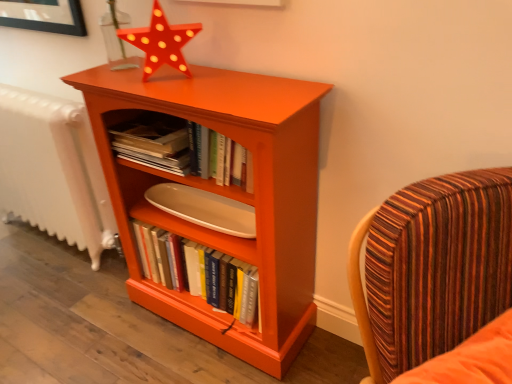
You are a GUI agent. You are given a task and a screenshot of the screen. Output one action in this format:
    pyautogui.click(x=<x>, y=<y>)
    Task: Click on the hardcover books at center, marked as the first book in a bottom-to-top arrangement
    The width and height of the screenshot is (512, 384).
    Given the screenshot: What is the action you would take?
    pyautogui.click(x=198, y=272)

Between matte orange shelf at center and striped fabric chair at right, which one has smaller size?

matte orange shelf at center is smaller.

Is matte orange shelf at center positioned far away from striped fabric chair at right?

No.

Is matte orange shelf at center not inside striped fabric chair at right?

Absolutely, matte orange shelf at center is external to striped fabric chair at right.

Consider the image. Does hardcover books at center, marked as the first book in a bottom-to-top arrangement, have a smaller size compared to matte orange shelf at center?

No.

Is matte orange shelf at center at the back of hardcover books at center, positioned as the 2th book in top-to-bottom order?

No.

From a real-world perspective, is hardcover books at center, positioned as the 2th book in top-to-bottom order, under matte orange shelf at center?

Indeed, from a real-world perspective, hardcover books at center, positioned as the 2th book in top-to-bottom order, is positioned beneath matte orange shelf at center.

Is point (173, 267) closer to viewer compared to point (123, 182)?

No, it is behind (123, 182).

Is hardcover books at center, positioned as the 2th book in top-to-bottom order, beside matte orange star at upper center?

hardcover books at center, positioned as the 2th book in top-to-bottom order, and matte orange star at upper center are clearly separated.

Based on the photo, from the image's perspective, is hardcover books at center, positioned as the 2th book in top-to-bottom order, above or below matte orange star at upper center?

hardcover books at center, positioned as the 2th book in top-to-bottom order, is below matte orange star at upper center.

Does hardcover books at center, marked as the first book in a bottom-to-top arrangement, come in front of matte orange star at upper center?

No, the depth of hardcover books at center, marked as the first book in a bottom-to-top arrangement, is greater than that of matte orange star at upper center.

Is hardcover books at center, marked as the first book in a bottom-to-top arrangement, not inside matte orange star at upper center?

hardcover books at center, marked as the first book in a bottom-to-top arrangement, is positioned outside matte orange star at upper center.

From the picture: Is the surface of matte orange shelf at center in direct contact with matte orange star at upper center?

No, matte orange shelf at center is not beside matte orange star at upper center.

Is matte orange shelf at center surrounding matte orange star at upper center?

No.

How many degrees apart are the facing directions of matte orange shelf at center and matte orange star at upper center?

Result: 42.9 degrees.

Based on the photo, considering the sizes of objects hardcover books at center, positioned as the 2th book in top-to-bottom order, and white textured radiator at left in the image provided, who is taller, hardcover books at center, positioned as the 2th book in top-to-bottom order, or white textured radiator at left?

Standing taller between the two is white textured radiator at left.

How different are the orientations of hardcover books at center, positioned as the 2th book in top-to-bottom order, and white textured radiator at left in degrees?

The angular difference between hardcover books at center, positioned as the 2th book in top-to-bottom order, and white textured radiator at left is 1.34 degrees.

Does hardcover books at center, marked as the first book in a bottom-to-top arrangement, have a larger size compared to white textured radiator at left?

No, hardcover books at center, marked as the first book in a bottom-to-top arrangement, is not bigger than white textured radiator at left.

Which object is further away from the camera, hardcover books at center, positioned as the 2th book in top-to-bottom order, or white textured radiator at left?

white textured radiator at left is further away from the camera.

In the scene shown: Considering the sizes of objects white textured radiator at left and matte orange shelf at center in the image provided, who is wider, white textured radiator at left or matte orange shelf at center?

With larger width is matte orange shelf at center.

Between white textured radiator at left and matte orange shelf at center, which one has less height?

matte orange shelf at center.

Which of these two, white textured radiator at left or matte orange shelf at center, is bigger?

white textured radiator at left.

Is white textured radiator at left situated inside matte orange shelf at center or outside?

white textured radiator at left is not inside matte orange shelf at center, it's outside.

From the image's perspective, does hardcover books at center, which appears as the first book when viewed from the top, appear lower than matte orange shelf at center?

Incorrect, from the image's perspective, hardcover books at center, which appears as the first book when viewed from the top, is higher than matte orange shelf at center.

Is hardcover books at center, which appears as the first book when viewed from the top, positioned beyond the bounds of matte orange shelf at center?

hardcover books at center, which appears as the first book when viewed from the top, is positioned outside matte orange shelf at center.

Does hardcover books at center, the second book in the bottom-to-top sequence, have a lesser height compared to matte orange shelf at center?

No, hardcover books at center, the second book in the bottom-to-top sequence, is not shorter than matte orange shelf at center.

The image size is (512, 384). What are the coordinates of `chair that appears on the right of matte orange shelf at center` in the screenshot? It's located at (432, 268).

Identify the location of shelf above the hardcover books at center, positioned as the 2th book in top-to-bottom order (from a real-world perspective). The image size is (512, 384). (194, 200).

Based on the photo, looking at the image, which one is located closer to matte orange shelf at center, matte orange star at upper center or white textured radiator at left?

Among the two, matte orange star at upper center is located nearer to matte orange shelf at center.

Estimate the real-world distances between objects in this image. Which object is further from striped fabric chair at right, matte orange shelf at center or hardcover books at center, marked as the first book in a bottom-to-top arrangement?

hardcover books at center, marked as the first book in a bottom-to-top arrangement.

Considering their positions, is hardcover books at center, which appears as the first book when viewed from the top, positioned further to orange matte wood bookcase at center than hardcover books at center, positioned as the 2th book in top-to-bottom order?

hardcover books at center, which appears as the first book when viewed from the top.

Which object lies nearer to the anchor point matte orange shelf at center, white textured radiator at left or matte orange star at upper center?

matte orange star at upper center.

Which object lies nearer to the anchor point matte orange star at upper center, orange matte wood bookcase at center or striped fabric chair at right?

Among the two, orange matte wood bookcase at center is located nearer to matte orange star at upper center.

Looking at the image, which one is located further to hardcover books at center, which appears as the first book when viewed from the top, orange matte wood bookcase at center or matte orange shelf at center?

Based on the image, orange matte wood bookcase at center appears to be further to hardcover books at center, which appears as the first book when viewed from the top.

Based on their spatial positions, is hardcover books at center, the second book in the bottom-to-top sequence, or hardcover books at center, positioned as the 2th book in top-to-bottom order, further from matte orange shelf at center?

hardcover books at center, positioned as the 2th book in top-to-bottom order, is positioned further to the anchor matte orange shelf at center.

Estimate the real-world distances between objects in this image. Which object is closer to white textured radiator at left, striped fabric chair at right or hardcover books at center, the second book in the bottom-to-top sequence?

The object closer to white textured radiator at left is hardcover books at center, the second book in the bottom-to-top sequence.

Find the location of a particular element. The image size is (512, 384). book situated between white textured radiator at left and orange matte wood bookcase at center from left to right is located at coordinates (183, 149).

Where is `bookcase that lies between matte orange star at upper center and striped fabric chair at right from top to bottom`? The image size is (512, 384). bookcase that lies between matte orange star at upper center and striped fabric chair at right from top to bottom is located at coordinates (225, 195).

At what (x,y) coordinates should I click in order to perform the action: click on shelf between hardcover books at center, which appears as the first book when viewed from the top, and hardcover books at center, marked as the first book in a bottom-to-top arrangement, vertically. Please return your answer as a coordinate pair (x, y). Looking at the image, I should click on (194, 200).

This screenshot has width=512, height=384. I want to click on book located between white textured radiator at left and matte orange star at upper center in the left-right direction, so click(x=183, y=149).